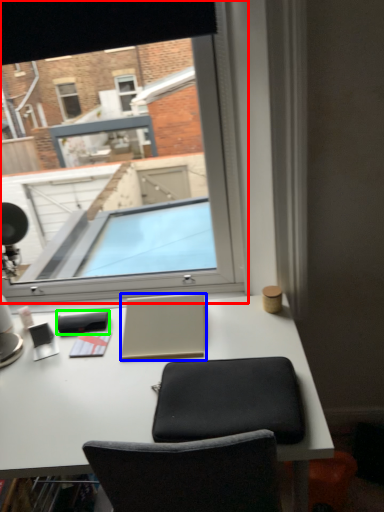
Question: Based on their relative distances, which object is nearer to window (highlighted by a red box)? Choose from laptop (highlighted by a blue box) and notepad (highlighted by a green box).

Choices:
 (A) laptop
 (B) notepad

Answer: (A)